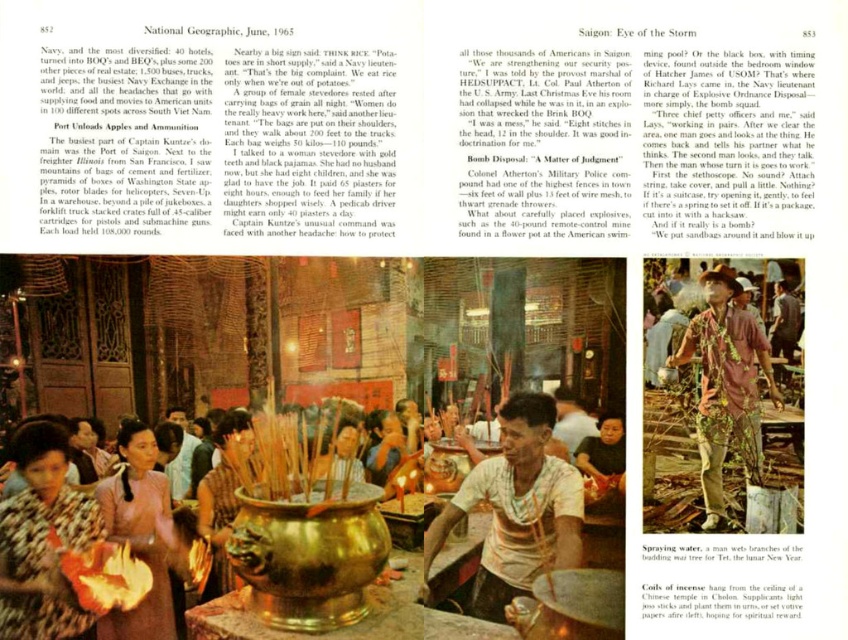
Does fluffy leopard print dress at center have a greater height compared to green leafy garland at center?

In fact, fluffy leopard print dress at center may be shorter than green leafy garland at center.

Between point (48, 596) and point (752, 360), which one is positioned in front?

Positioned in front is point (48, 596).

Who is more distant from viewer, [38,576] or [715,476]?

Positioned behind is point [715,476].

In order to click on fluffy leopard print dress at center in this screenshot , I will do `click(43, 540)`.

Can you confirm if white cotton shirt at center is wider than smooth brown incense sticks at center?

Correct, the width of white cotton shirt at center exceeds that of smooth brown incense sticks at center.

I want to click on white cotton shirt at center, so click(x=515, y=509).

Image resolution: width=848 pixels, height=640 pixels. What do you see at coordinates (515, 509) in the screenshot?
I see `white cotton shirt at center` at bounding box center [515, 509].

Locate an element on the screen. The height and width of the screenshot is (640, 848). white cotton shirt at center is located at coordinates (515, 509).

Which is above, white cotton shirt at center or fluffy leopard print dress at center?

white cotton shirt at center

Between white cotton shirt at center and fluffy leopard print dress at center, which one is positioned lower?

fluffy leopard print dress at center

Where is `white cotton shirt at center`? white cotton shirt at center is located at coordinates (515, 509).

Locate an element on the screen. white cotton shirt at center is located at coordinates (515, 509).